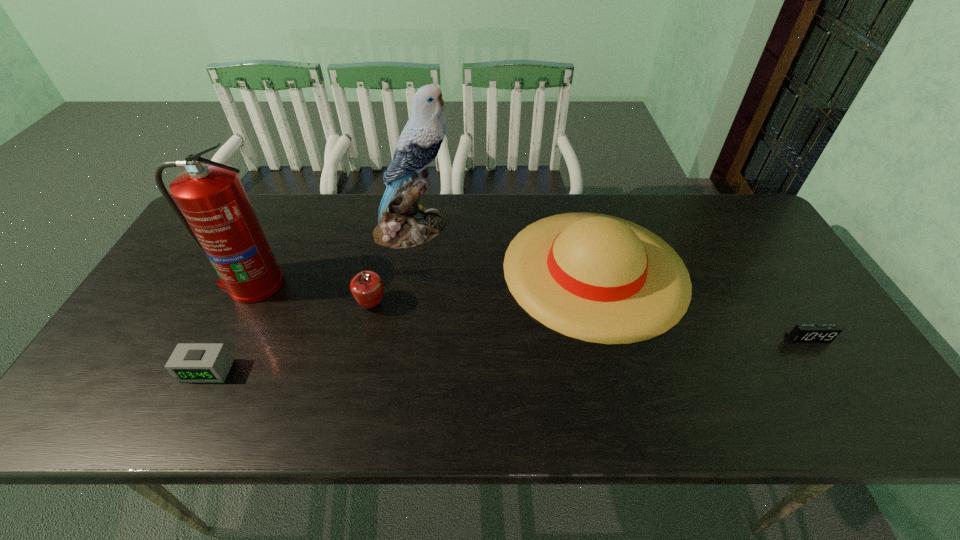
The image size is (960, 540). What are the coordinates of `vacant space situated 0.190m on the instruction side of the fire extinguisher` in the screenshot? It's located at (212, 366).

Locate an element on the screen. The image size is (960, 540). free space located on the left of the sombrero is located at coordinates (447, 269).

The image size is (960, 540). I want to click on free region located on the right of the apple, so click(x=535, y=304).

At what (x,y) coordinates should I click in order to perform the action: click on free space located on the front-facing side of the nearest object. Please return your answer as a coordinate pair (x, y). This screenshot has width=960, height=540. Looking at the image, I should click on (180, 424).

The width and height of the screenshot is (960, 540). In order to click on free location located on the front-facing side of the shortest object in this screenshot , I will do `click(824, 364)`.

You are a GUI agent. You are given a task and a screenshot of the screen. Output one action in this format:
    pyautogui.click(x=<x>, y=<y>)
    Task: Click on the parakeet present at the far edge
    
    Given the screenshot: What is the action you would take?
    pyautogui.click(x=402, y=223)

Where is `sombrero present at the far edge`? sombrero present at the far edge is located at coordinates (598, 278).

Identify the location of object located at the left edge. (215, 210).

Where is `object present at the right edge`? The width and height of the screenshot is (960, 540). object present at the right edge is located at coordinates (802, 333).

I want to click on free space at the far edge, so click(x=263, y=208).